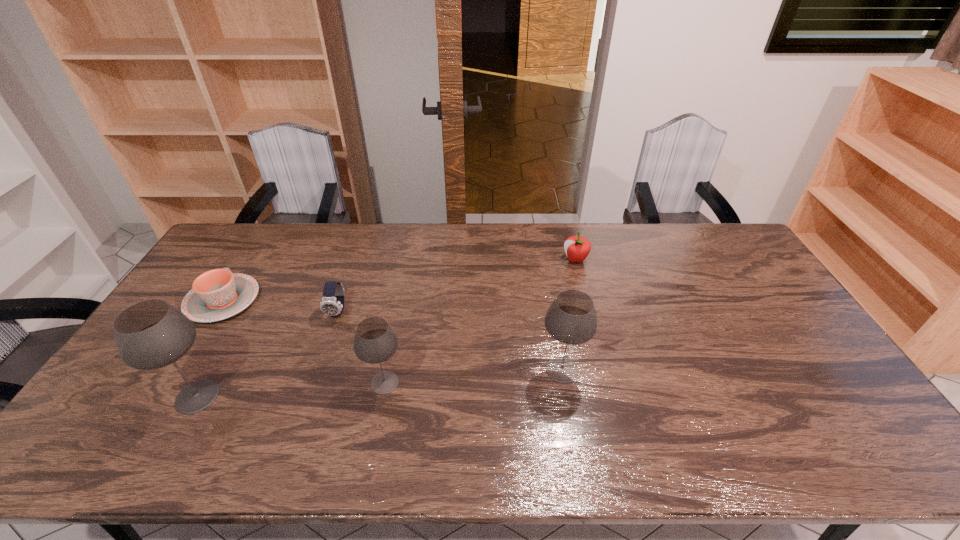
Image resolution: width=960 pixels, height=540 pixels. Identify the location of free location located on the back of the fourth shortest object. (401, 296).

At what (x,y) coordinates should I click in order to perform the action: click on vacant space situated on the left of the fifth object from left to right. Please return your answer as a coordinate pair (x, y). This screenshot has height=540, width=960. Looking at the image, I should click on (446, 369).

Locate an element on the screen. free space located 0.170m on the back of the apple is located at coordinates (566, 225).

Where is `free region located 0.110m on the face of the third object from left to right`? Image resolution: width=960 pixels, height=540 pixels. free region located 0.110m on the face of the third object from left to right is located at coordinates (324, 351).

The height and width of the screenshot is (540, 960). In order to click on vacant region located 0.200m on the handle side of the shortest object in this screenshot , I will do `click(260, 242)`.

Where is `vacant space located on the handle side of the shortest object`? This screenshot has width=960, height=540. vacant space located on the handle side of the shortest object is located at coordinates (251, 258).

Where is `vacant space situated on the handle side of the shortest object`? vacant space situated on the handle side of the shortest object is located at coordinates (267, 232).

You are a GUI agent. You are given a task and a screenshot of the screen. Output one action in this format:
    pyautogui.click(x=<x>, y=<y>)
    Task: Click on the object that is at the far edge
    
    Given the screenshot: What is the action you would take?
    pyautogui.click(x=577, y=248)

Identify the location of wineglass that is at the left edge. [x=151, y=334].

I want to click on chinaware present at the left edge, so click(x=218, y=294).